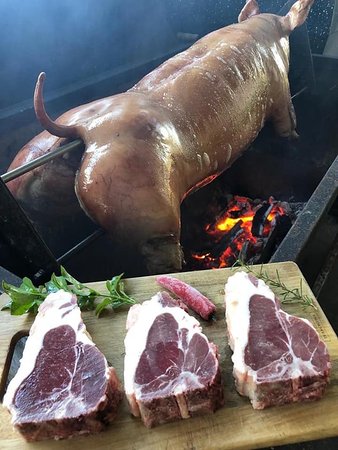
Locate an element on the screen. This screenshot has height=450, width=338. chopping board is located at coordinates pos(201,427).